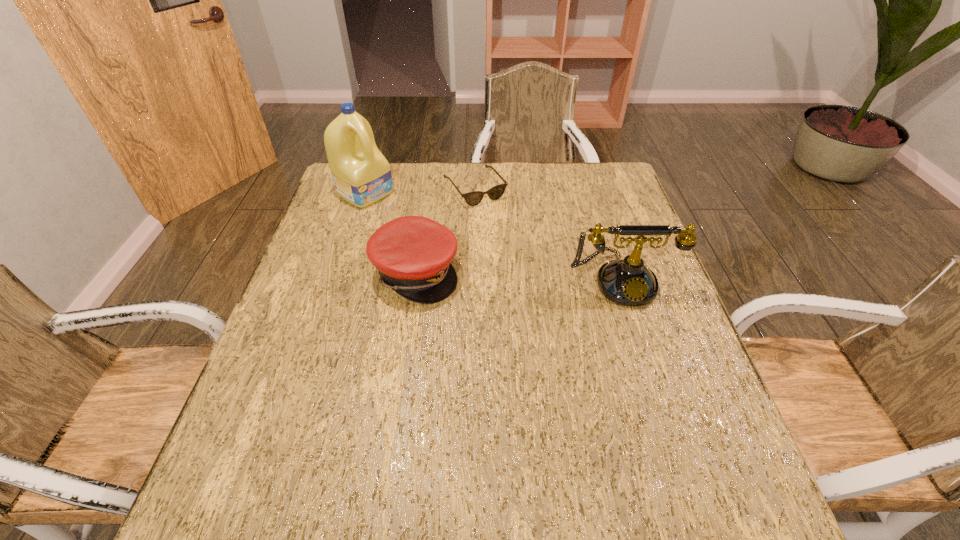
Locate an element on the screen. Image resolution: width=960 pixels, height=540 pixels. vacant space at the left edge of the desktop is located at coordinates (352, 227).

This screenshot has height=540, width=960. I want to click on vacant area at the right edge, so pos(603,218).

This screenshot has height=540, width=960. In the image, there is a desktop. In order to click on free space at the far right corner in this screenshot , I will do `click(592, 200)`.

Locate an element on the screen. This screenshot has width=960, height=540. vacant area between the cap and the third shortest object is located at coordinates (518, 276).

I want to click on vacant space that is in between the third shortest object and the second shortest object, so click(518, 276).

Locate an element on the screen. The height and width of the screenshot is (540, 960). vacant area between the detergent and the rightmost object is located at coordinates (492, 236).

The height and width of the screenshot is (540, 960). What are the coordinates of `vacant area that lies between the rightmost object and the detergent` in the screenshot? It's located at (492, 236).

The height and width of the screenshot is (540, 960). Identify the location of vacant area between the cap and the telephone. (518, 276).

The height and width of the screenshot is (540, 960). Identify the location of free spot between the telephone and the cap. (518, 276).

Identify which object is the third closest to the rightmost object. Please provide its 2D coordinates. Your answer should be formatted as a tuple, i.e. [(x, y)], where the tuple contains the x and y coordinates of a point satisfying the conditions above.

[(362, 176)]